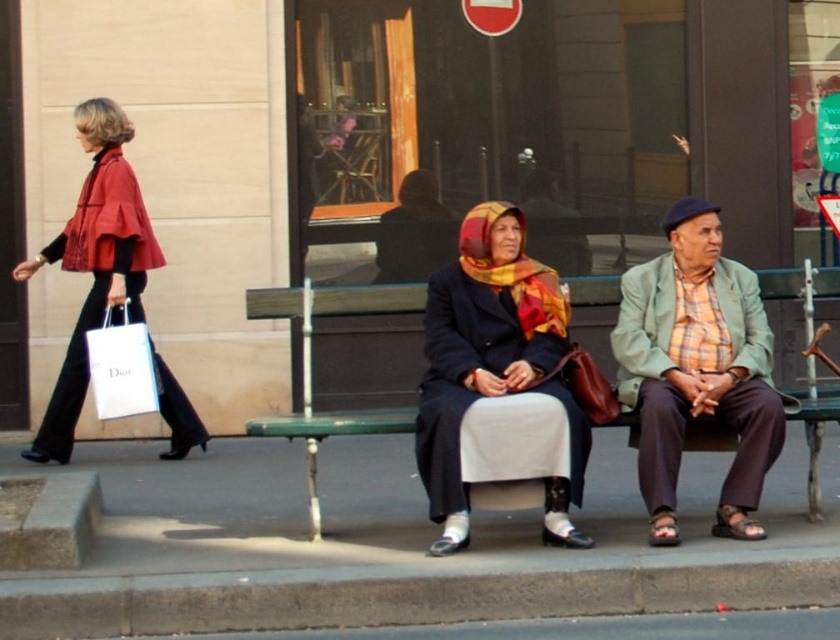
Question: Is gray concrete curb at lower left positioned before green textured blazer at center?

Choices:
 (A) yes
 (B) no

Answer: (A)

Question: Is green textured blazer at center to the left of matte red cape at left from the viewer's perspective?

Choices:
 (A) yes
 (B) no

Answer: (B)

Question: Which of these objects is positioned closest to the green painted wood bench at center?

Choices:
 (A) green textured blazer at center
 (B) gray concrete curb at lower left
 (C) concrete pavement at lower center

Answer: (B)

Question: Which point is closer to the camera?

Choices:
 (A) concrete pavement at lower center
 (B) matte red cape at left
 (C) green painted wood bench at center
 (D) matte black coat at center

Answer: (A)

Question: Which object is positioned closest to the white paper bag at left?

Choices:
 (A) gray concrete curb at lower left
 (B) matte red cape at left

Answer: (B)

Question: From the image, what is the correct spatial relationship of concrete pavement at lower center in relation to green painted wood bench at center?

Choices:
 (A) below
 (B) above

Answer: (A)